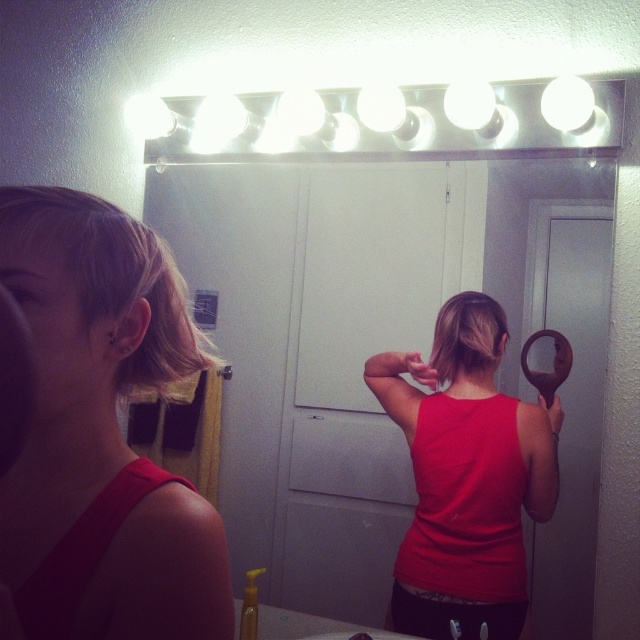
You are standing in the bathroom and want to reach the point at coordinates point [19,196]. Can you estimate how far you need to move forward to reach that point?

The point [19,196] is 23.02 inches from the viewer, so you need to move forward approximately 23.02 inches to reach it.

You are a fashion designer observing a model in a bathroom. The model is wearing a matte red tank top at center and has blonde hair at left. From the model s perspective, which item is closer to their face?

The blonde hair at left is closer to the model s face because it is positioned behind the matte red tank top at center, meaning the hair is in front of the tank top and thus closer to the face.